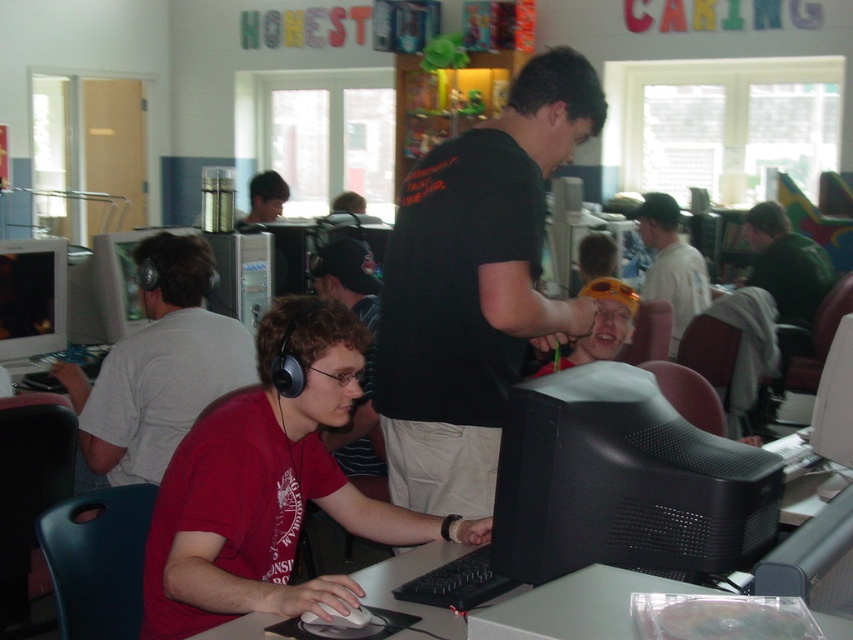
What do you see at coordinates (575, 605) in the screenshot? Image resolution: width=853 pixels, height=640 pixels. I see `white plastic table at lower center` at bounding box center [575, 605].

Can you confirm if white plastic table at lower center is bigger than matte black monitor at center?

Incorrect, white plastic table at lower center is not larger than matte black monitor at center.

Between point (596, 612) and point (686, 305), which one is positioned behind?

Positioned behind is point (686, 305).

This screenshot has height=640, width=853. In order to click on white plastic table at lower center in this screenshot , I will do `click(575, 605)`.

Which is more to the left, black matte monitor at center or matte black monitor at center?

From the viewer's perspective, black matte monitor at center appears more on the left side.

What do you see at coordinates (624, 483) in the screenshot? I see `black matte monitor at center` at bounding box center [624, 483].

What are the coordinates of `black matte monitor at center` in the screenshot? It's located at (624, 483).

Does matte red shirt at center have a lesser width compared to white plastic table at lower center?

Incorrect, matte red shirt at center's width is not less than white plastic table at lower center's.

Who is lower down, matte red shirt at center or white plastic table at lower center?

Positioned lower is white plastic table at lower center.

Describe the element at coordinates (160, 365) in the screenshot. This screenshot has height=640, width=853. I see `matte red shirt at center` at that location.

At what (x,y) coordinates should I click in order to perform the action: click on matte red shirt at center. Please return your answer as a coordinate pair (x, y). The width and height of the screenshot is (853, 640). Looking at the image, I should click on (160, 365).